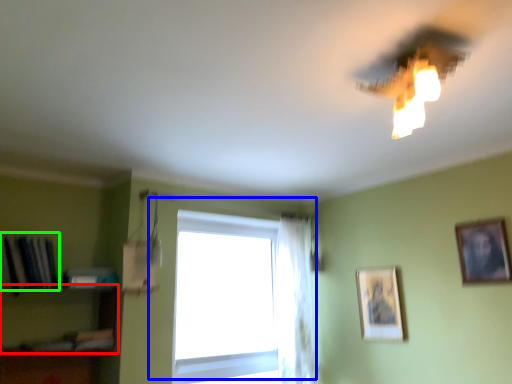
Question: Estimate the real-world distances between objects in this image. Which object is farther from shelf (highlighted by a red box), window (highlighted by a blue box) or book (highlighted by a green box)?

Choices:
 (A) window
 (B) book

Answer: (A)